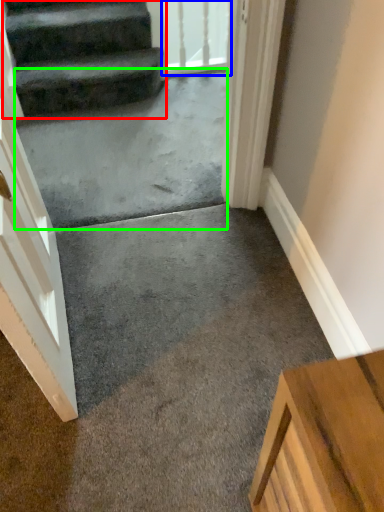
Question: Which object is positioned farthest from stairs (highlighted by a red box)? Select from glass door (highlighted by a blue box) and concrete (highlighted by a green box).

Choices:
 (A) glass door
 (B) concrete

Answer: (A)